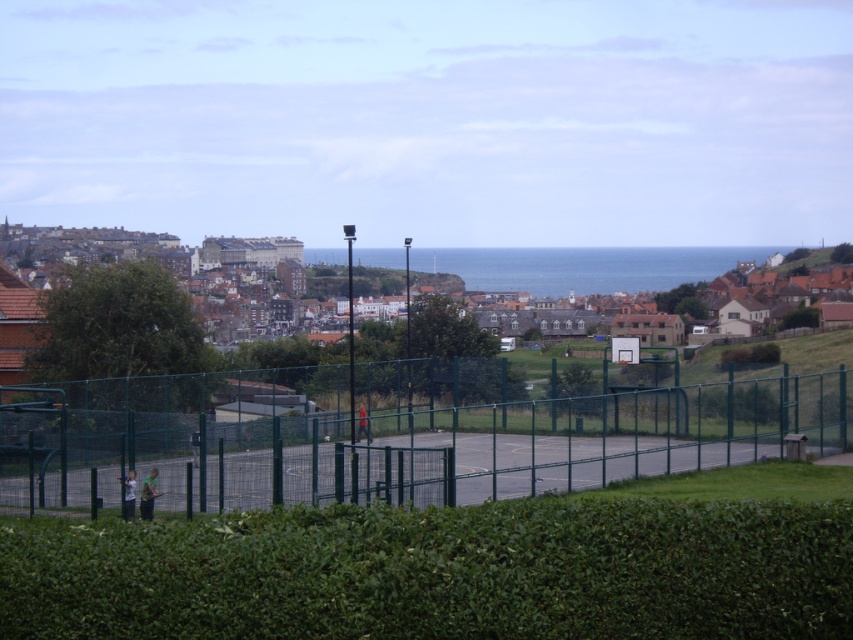
You are standing at the hedge in the coastal town scene and want to take a photo of both the basketball court fence and the residential houses. Which point, point (642, 410) or point (134, 474), should you focus on to ensure both areas are in the frame?

You should focus on point (642, 410) because it is closer to the camera compared to point (134, 474), allowing both the basketball court fence and the residential houses to be in the frame.

Consider the image. You are standing at the edge of the basketball court and want to walk towards the green fabric shirt at lower left. Which direction should you move relative to the green leafy hedge at center?

The green leafy hedge at center is on the right side of the green fabric shirt at lower left, so you should move to the left relative to the hedge to reach the shirt.

You are standing at the edge of the basketball court and want to see the light blue fabric shirt at lower left without moving. Can you see it through the green metal fence at center?

The green metal fence at center is positioned over the light blue fabric shirt at lower left, so the fence blocks the view of the shirt.